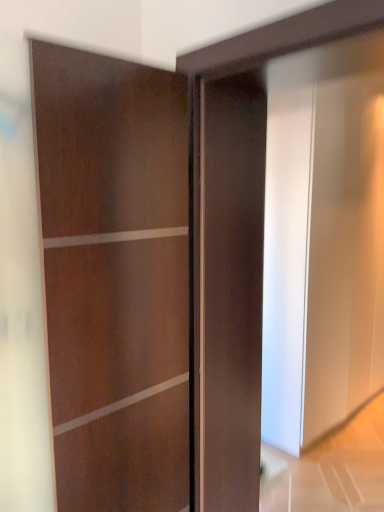
What do you see at coordinates (114, 277) in the screenshot?
I see `matte wood door at center` at bounding box center [114, 277].

At what (x,y) coordinates should I click in order to perform the action: click on matte wood door at center. Please return your answer as a coordinate pair (x, y). Looking at the image, I should click on (114, 277).

I want to click on matte wood door at center, so click(114, 277).